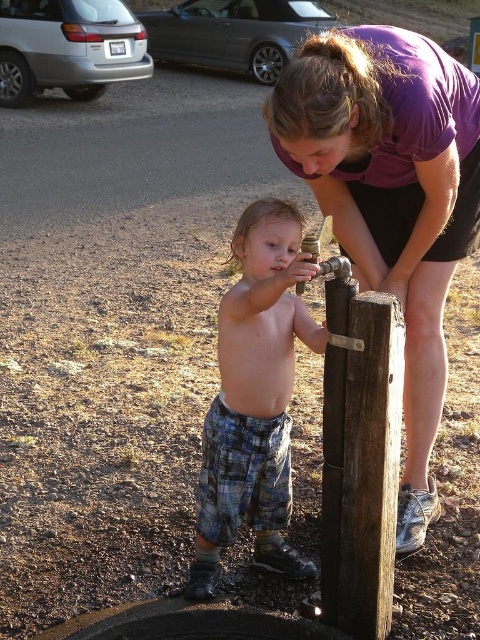
Is plaid pants at center above silver metallic van at upper left?

No, plaid pants at center is not above silver metallic van at upper left.

Is plaid pants at center shorter than silver metallic van at upper left?

Yes, plaid pants at center is shorter than silver metallic van at upper left.

The image size is (480, 640). I want to click on plaid pants at center, so click(x=254, y=397).

Does plaid pants at center have a lesser height compared to brushed metal car at upper center?

Yes, plaid pants at center is shorter than brushed metal car at upper center.

Does point (261, 556) come closer to viewer compared to point (200, 3)?

Yes, point (261, 556) is in front of point (200, 3).

You are a GUI agent. You are given a task and a screenshot of the screen. Output one action in this format:
    pyautogui.click(x=<x>, y=<y>)
    Task: Click on the plaid pants at center
    
    Given the screenshot: What is the action you would take?
    pyautogui.click(x=254, y=397)

Is silver metallic van at upper left shorter than brushed metal car at upper center?

Correct, silver metallic van at upper left is not as tall as brushed metal car at upper center.

Does silver metallic van at upper left lie behind brushed metal car at upper center?

No, it is in front of brushed metal car at upper center.

Where is `silver metallic van at upper left`? This screenshot has width=480, height=640. silver metallic van at upper left is located at coordinates (68, 48).